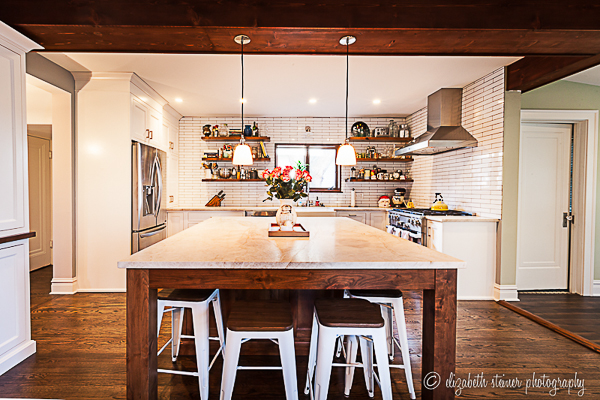
In order to click on lights in this screenshot , I will do `click(178, 97)`, `click(241, 96)`, `click(308, 97)`, `click(374, 99)`, `click(339, 149)`, `click(240, 155)`.